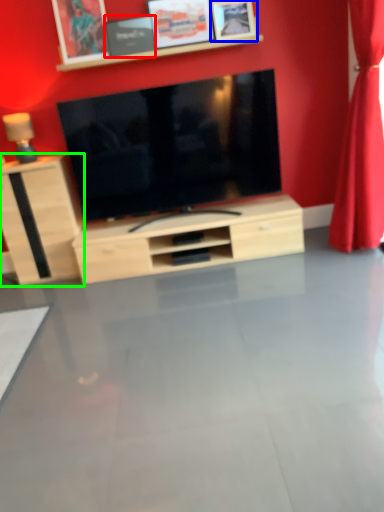
Question: Based on their relative distances, which object is nearer to picture frame (highlighted by a red box)? Choose from picture frame (highlighted by a blue box) and cabinetry (highlighted by a green box).

Choices:
 (A) picture frame
 (B) cabinetry

Answer: (A)